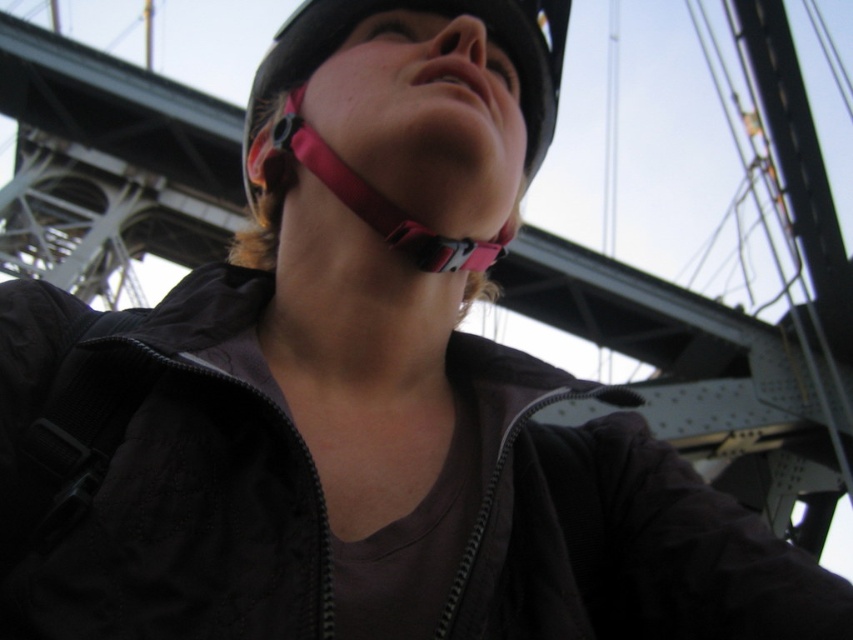
You are a photographer trying to adjust your equipment. You notice the black matte helmet at upper center and the pink fabric strap at center. Which object is located to the right of the other?

The black matte helmet at upper center is positioned on the right side of pink fabric strap at center.

You are a photographer trying to adjust your camera settings while standing on a bridge. You notice two points marked in the image. Which point is closer to you, point at coordinates (341, 6) or point at coordinates (370, 221)?

Point at coordinates (341, 6) is closer to you because it is further to the viewer than point at coordinates (370, 221).